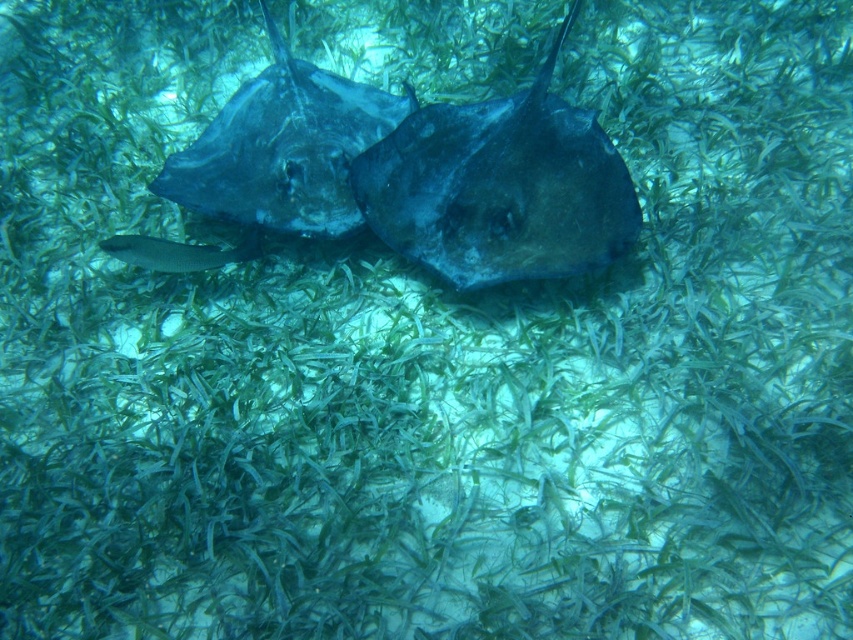
You are a marine biologist observing an underwater scene. You notice a dark blue glossy stingray at center and a silvery metallic fish at center. Which one is positioned higher in the water column?

The dark blue glossy stingray at center is positioned higher in the water column because it is above the silvery metallic fish at center.